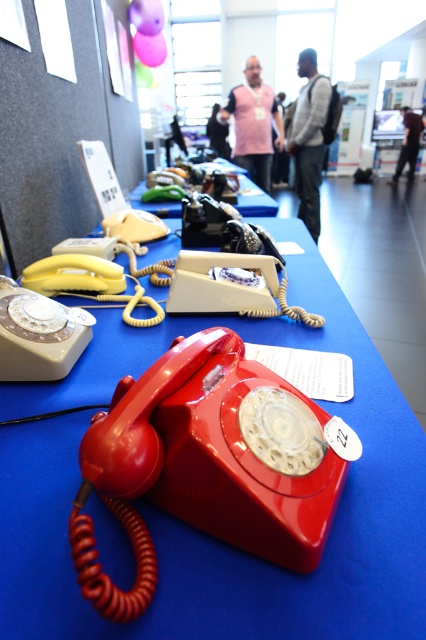
You are a tailor who needs to determine if the pink fabric vest at center can be placed on top of the matte black telephone at center without obstructing the telephone. Based on the scene description, can you confirm if this is possible?

The pink fabric vest at center has a greater height compared to matte black telephone at center, so placing it on top would likely obstruct the telephone due to its larger size.

You are a museum curator arranging an exhibit. You have a matte plastic telephone at center and a matte black telephone at center. Which telephone is placed higher in the display?

The matte black telephone at center is placed higher than the matte plastic telephone at center because the matte plastic telephone at center is positioned under it.

You are a visitor at a vintage exhibit and see the matte plastic telephone at center and the gray sweater at center. Which object is positioned to the right side?

The gray sweater at center is positioned to the right of the matte plastic telephone at center.